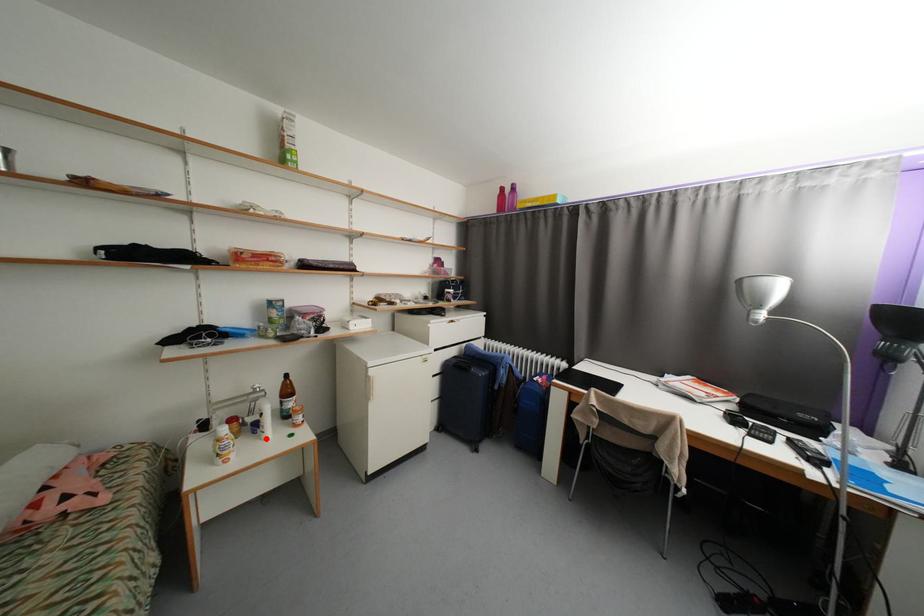
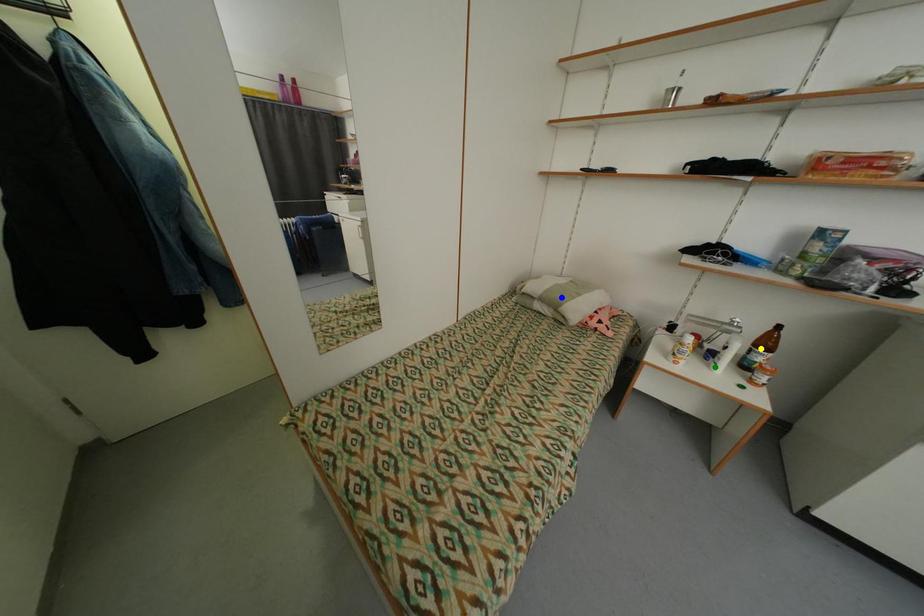
Question: I am providing you with two images of the same scene from different viewpoints. A red point is marked on the first image. You are given multiple points on the second image. In image 2, which mark is for the same physical point as the one in image 1?

Choices:
 (A) yellow point
 (B) blue point
 (C) green point

Answer: (C)